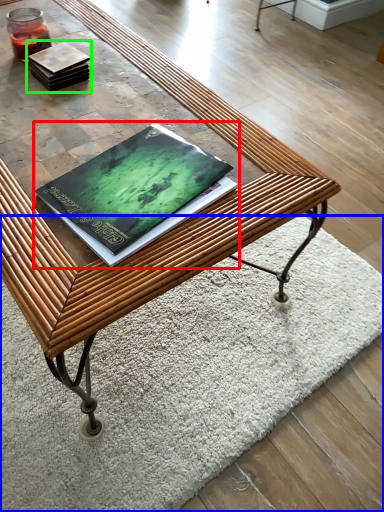
Question: Which object is positioned farthest from book (highlighted by a red box)? Select from mat (highlighted by a blue box) and book (highlighted by a green box).

Choices:
 (A) mat
 (B) book

Answer: (A)